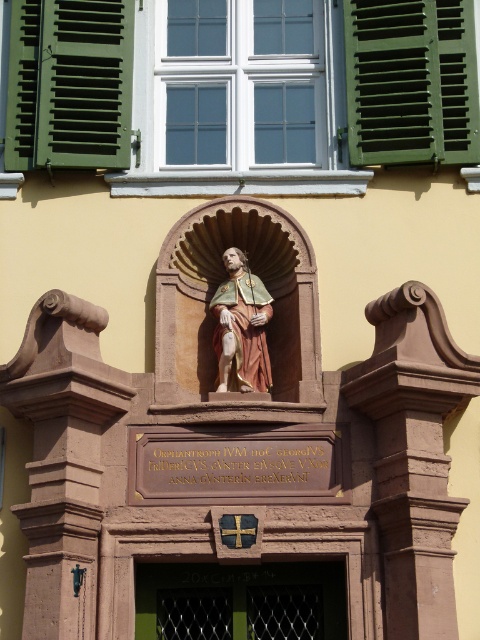
Question: Based on their relative distances, which object is farther from the green metal gate at lower center?

Choices:
 (A) polychrome wood statue at center
 (B) green matte shutters at upper left

Answer: (B)

Question: Which object appears farthest from the camera in this image?

Choices:
 (A) green metal gate at lower center
 (B) green matte shutters at upper left

Answer: (B)

Question: Does green matte shutters at upper left appear under green metal gate at lower center?

Choices:
 (A) no
 (B) yes

Answer: (A)

Question: Can you confirm if green painted wood at upper right is positioned to the left of green metal gate at lower center?

Choices:
 (A) no
 (B) yes

Answer: (A)

Question: Estimate the real-world distances between objects in this image. Which object is farther from the green matte shutters at upper left?

Choices:
 (A) green metal gate at lower center
 (B) polychrome wood statue at center

Answer: (A)

Question: Is green painted wood at upper right below polychrome wood statue at center?

Choices:
 (A) yes
 (B) no

Answer: (B)